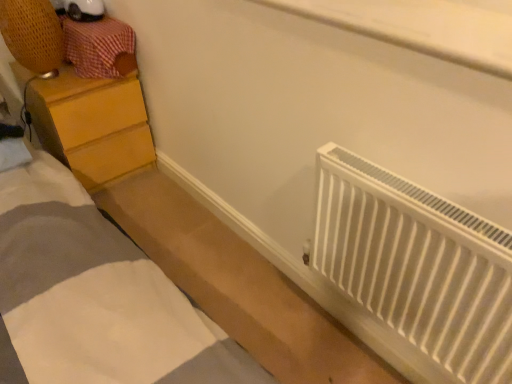
Question: Based on their sizes in the image, would you say wooden drawer at upper left is bigger or smaller than wooden chest of drawers at left?

Choices:
 (A) small
 (B) big

Answer: (A)

Question: Would you say wooden drawer at upper left is to the left or to the right of wooden chest of drawers at left in the picture?

Choices:
 (A) right
 (B) left

Answer: (A)

Question: Based on their relative distances, which object is farther from the white matte bed at lower right?

Choices:
 (A) wooden chest of drawers at left
 (B) wooden drawer at upper left
 (C) white plastic radiator at lower right

Answer: (B)

Question: Which is nearer to the wooden chest of drawers at left?

Choices:
 (A) white matte bed at lower right
 (B) wooden drawer at upper left
 (C) white plastic radiator at lower right

Answer: (B)